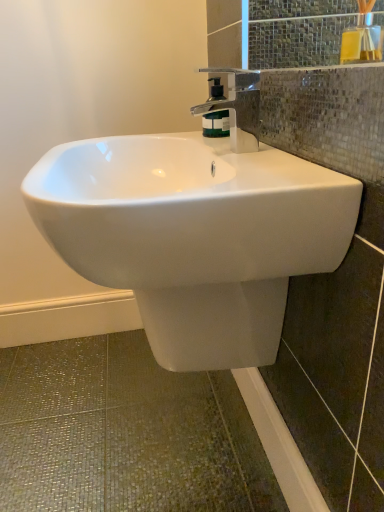
Question: Would you say yellow glass bottle at upper right is outside green matte soap dispenser at center?

Choices:
 (A) yes
 (B) no

Answer: (A)

Question: Is yellow glass bottle at upper right with green matte soap dispenser at center?

Choices:
 (A) yes
 (B) no

Answer: (B)

Question: From the image's perspective, is yellow glass bottle at upper right located beneath green matte soap dispenser at center?

Choices:
 (A) yes
 (B) no

Answer: (B)

Question: From a real-world perspective, is yellow glass bottle at upper right positioned over green matte soap dispenser at center based on gravity?

Choices:
 (A) no
 (B) yes

Answer: (B)

Question: From the image's perspective, would you say yellow glass bottle at upper right is positioned over green matte soap dispenser at center?

Choices:
 (A) yes
 (B) no

Answer: (A)

Question: From the image's perspective, is polished chrome faucet at upper center positioned above or below green matte soap dispenser at center?

Choices:
 (A) below
 (B) above

Answer: (A)

Question: Relative to green matte soap dispenser at center, is polished chrome faucet at upper center in front or behind?

Choices:
 (A) front
 (B) behind

Answer: (A)

Question: Based on their sizes in the image, would you say polished chrome faucet at upper center is bigger or smaller than green matte soap dispenser at center?

Choices:
 (A) small
 (B) big

Answer: (B)

Question: Is polished chrome faucet at upper center taller or shorter than green matte soap dispenser at center?

Choices:
 (A) short
 (B) tall

Answer: (B)

Question: In the image, is polished chrome faucet at upper center positioned in front of or behind white glossy sink at center?

Choices:
 (A) behind
 (B) front

Answer: (A)

Question: Looking at the image, does polished chrome faucet at upper center seem bigger or smaller compared to white glossy sink at center?

Choices:
 (A) small
 (B) big

Answer: (A)

Question: In terms of width, does polished chrome faucet at upper center look wider or thinner when compared to white glossy sink at center?

Choices:
 (A) thin
 (B) wide

Answer: (A)

Question: From the image's perspective, is polished chrome faucet at upper center above or below white glossy sink at center?

Choices:
 (A) above
 (B) below

Answer: (A)

Question: Relative to white glossy sink at center, is yellow glass bottle at upper right in front or behind?

Choices:
 (A) behind
 (B) front

Answer: (A)

Question: Considering the positions of yellow glass bottle at upper right and white glossy sink at center in the image, is yellow glass bottle at upper right bigger or smaller than white glossy sink at center?

Choices:
 (A) small
 (B) big

Answer: (A)